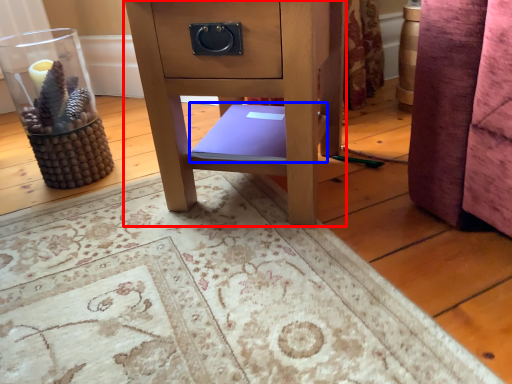
Question: Which object appears farthest to the camera in this image, furniture (highlighted by a red box) or book (highlighted by a blue box)?

Choices:
 (A) furniture
 (B) book

Answer: (B)